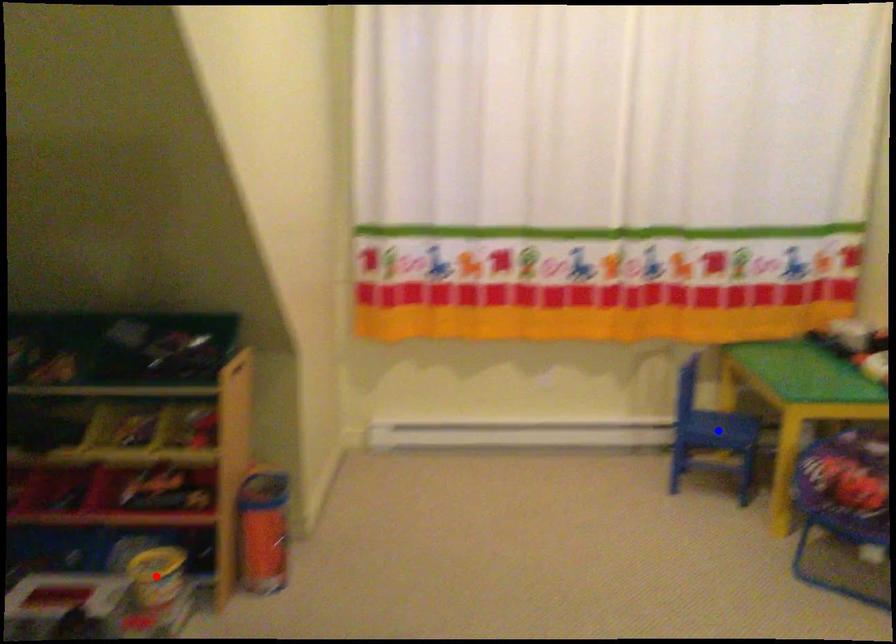
Question: Two points are marked on the image. Which point is closer to the camera?

Choices:
 (A) Blue point is closer.
 (B) Red point is closer.

Answer: (B)